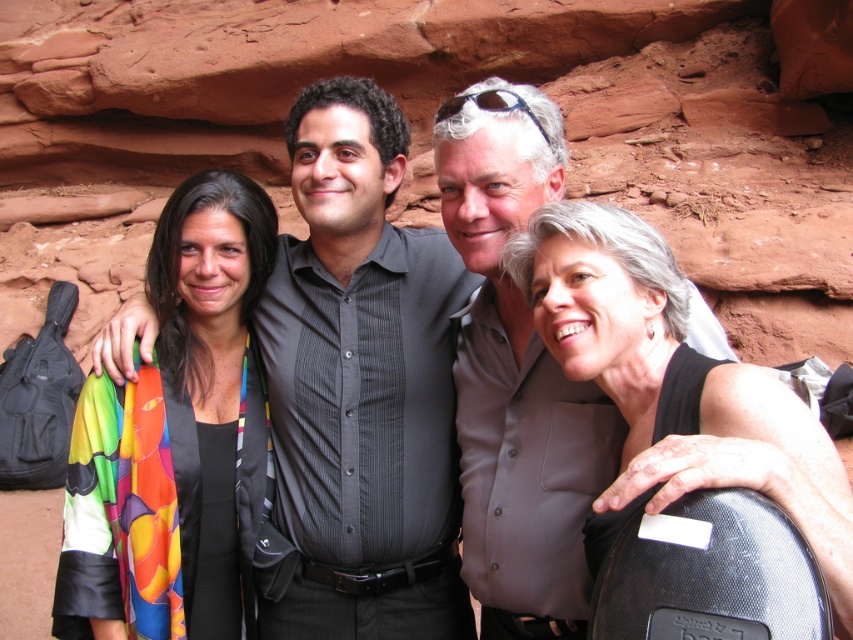
You are a photographer trying to decide which item to focus on for a closeup shot. The multicolored fabric scarf at left and the black matte tank top at right are both in your frame. Based on their sizes, which item would require you to get closer to fill the frame adequately?

The multicolored fabric scarf at left is smaller in width than the black matte tank top at right, so you would need to get closer to the multicolored fabric scarf at left to fill the frame adequately.

You are a photographer trying to capture the group in the image. You notice the multicolored fabric scarf at left and the gray matte shirt at center. Which of these two items is positioned lower in the frame?

The multicolored fabric scarf at left is below the gray matte shirt at center, so it is positioned lower in the frame.

You are a photographer trying to capture a closeup of the multicolored fabric scarf at left and the gray matte shirt at center. Since you want both to be in focus, which object should you adjust your camera settings to prioritize focusing on first?

The multicolored fabric scarf at left occupies less space than the gray matte shirt at center, so you should prioritize focusing on the gray matte shirt at center first because it takes up more of the frame and will require precise focus to ensure clarity.